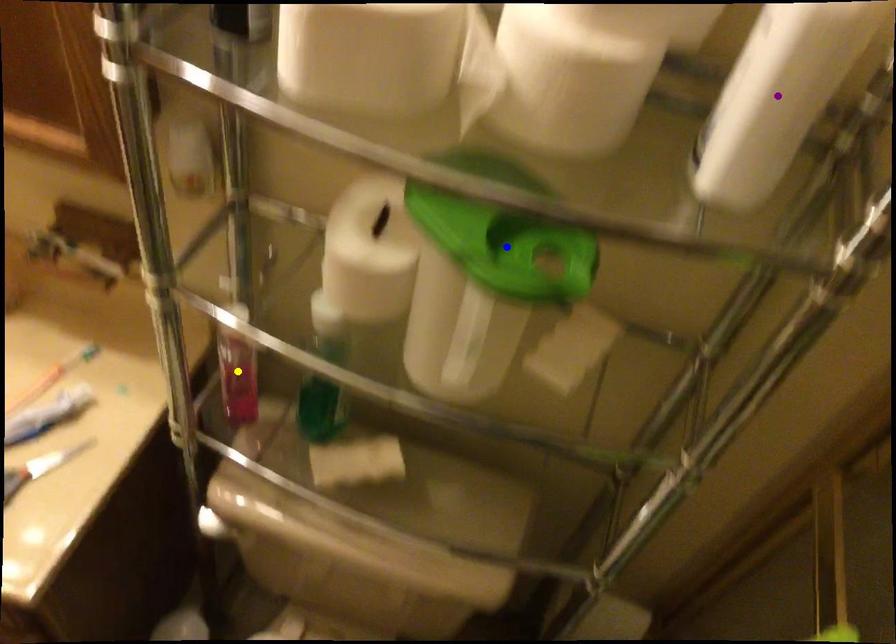
Based on the photo, order these from nearest to farthest:
blue point, purple point, yellow point

yellow point, blue point, purple point